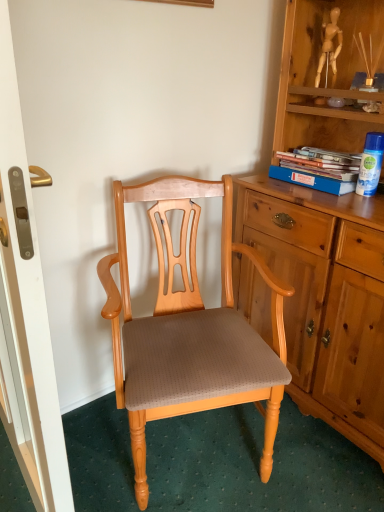
Question: Does matte wood screen door at left have a larger size compared to blue cardboard book at upper right?

Choices:
 (A) yes
 (B) no

Answer: (A)

Question: From a real-world perspective, does matte wood screen door at left stand above blue cardboard book at upper right?

Choices:
 (A) no
 (B) yes

Answer: (A)

Question: Is matte wood screen door at left turned away from blue cardboard book at upper right?

Choices:
 (A) yes
 (B) no

Answer: (A)

Question: Is matte wood screen door at left positioned beyond the bounds of blue cardboard book at upper right?

Choices:
 (A) yes
 (B) no

Answer: (A)

Question: Is matte wood screen door at left oriented towards blue cardboard book at upper right?

Choices:
 (A) yes
 (B) no

Answer: (B)

Question: Considering the relative sizes of matte wood screen door at left and blue cardboard book at upper right in the image provided, is matte wood screen door at left taller than blue cardboard book at upper right?

Choices:
 (A) no
 (B) yes

Answer: (B)

Question: Is blue plastic spray can at upper right wider than light brown wood chair at center?

Choices:
 (A) yes
 (B) no

Answer: (B)

Question: Considering the relative positions of blue plastic spray can at upper right and light brown wood chair at center in the image provided, is blue plastic spray can at upper right to the left of light brown wood chair at center from the viewer's perspective?

Choices:
 (A) yes
 (B) no

Answer: (B)

Question: Considering the relative sizes of blue plastic spray can at upper right and light brown wood chair at center in the image provided, is blue plastic spray can at upper right thinner than light brown wood chair at center?

Choices:
 (A) no
 (B) yes

Answer: (B)

Question: From the image's perspective, is blue plastic spray can at upper right beneath light brown wood chair at center?

Choices:
 (A) yes
 (B) no

Answer: (B)

Question: Is blue plastic spray can at upper right oriented away from light brown wood chair at center?

Choices:
 (A) no
 (B) yes

Answer: (A)

Question: Does blue plastic spray can at upper right have a smaller size compared to light brown wood chair at center?

Choices:
 (A) yes
 (B) no

Answer: (A)

Question: Is blue cardboard book at upper right positioned before matte wood screen door at left?

Choices:
 (A) yes
 (B) no

Answer: (B)